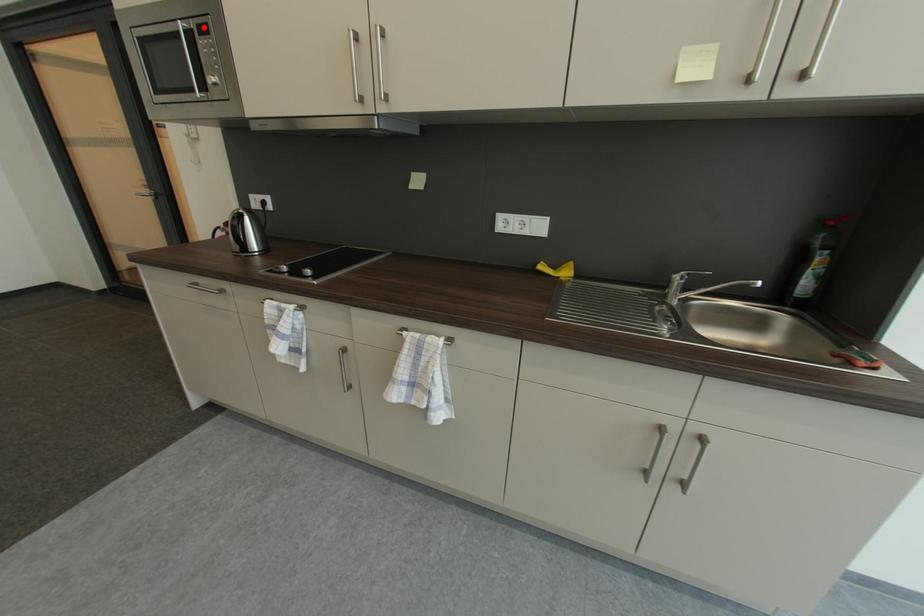
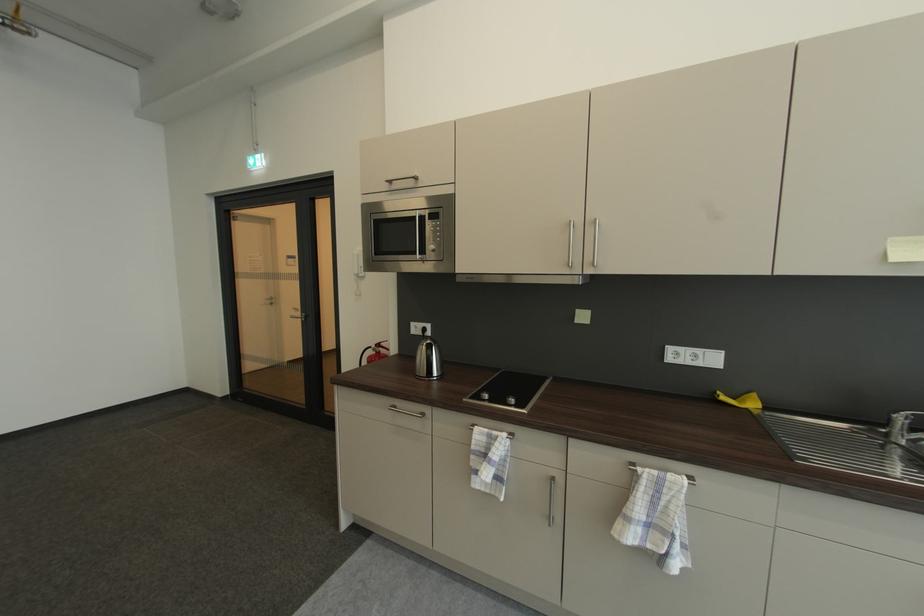
Question: A red point is marked in image1. In image2, is the corresponding 3D point closer to the camera or farther? Reply with the corresponding letter.

Choices:
 (A) The corresponding 3D point is closer.
 (B) The corresponding 3D point is farther.

Answer: (A)